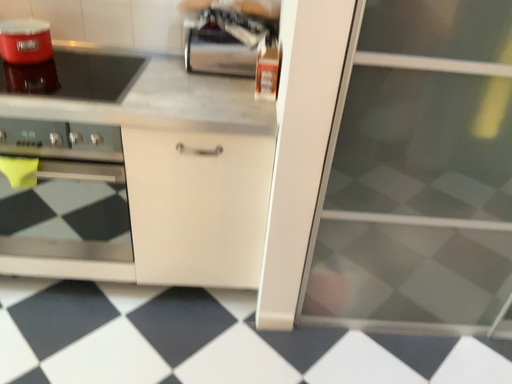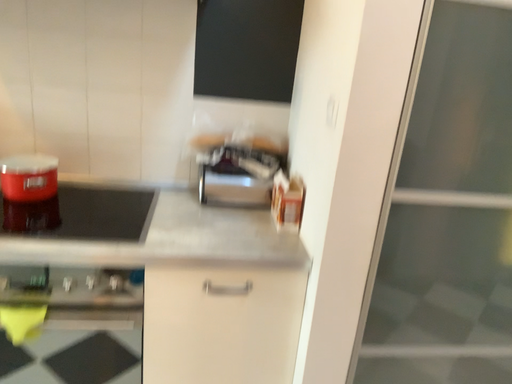
Question: Which way did the camera rotate in the video?

Choices:
 (A) rotated upward
 (B) rotated downward

Answer: (A)